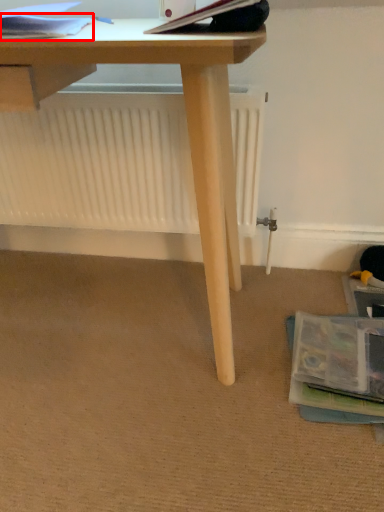
Question: Where is paperback book (annotated by the red box) located in relation to paperback book in the image?

Choices:
 (A) left
 (B) right

Answer: (A)